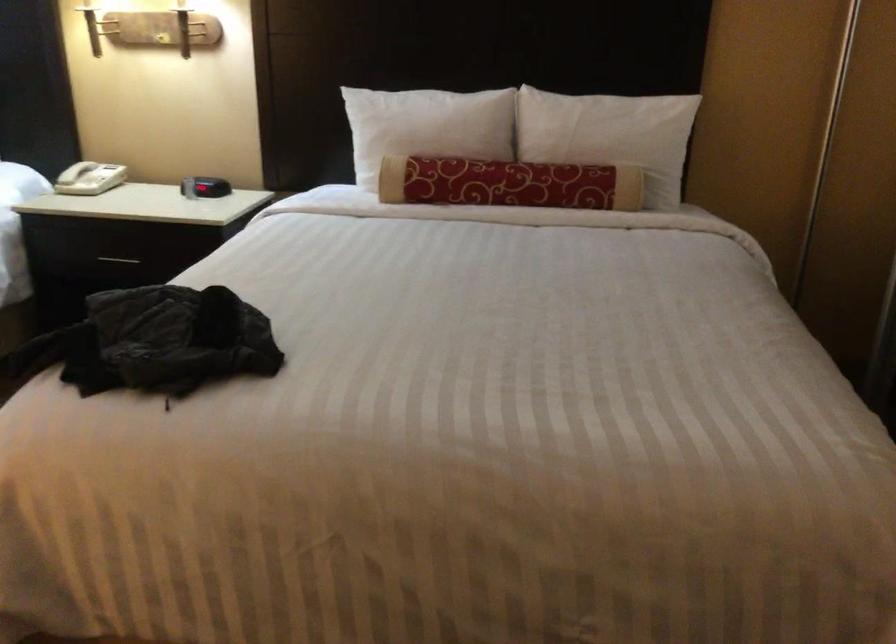
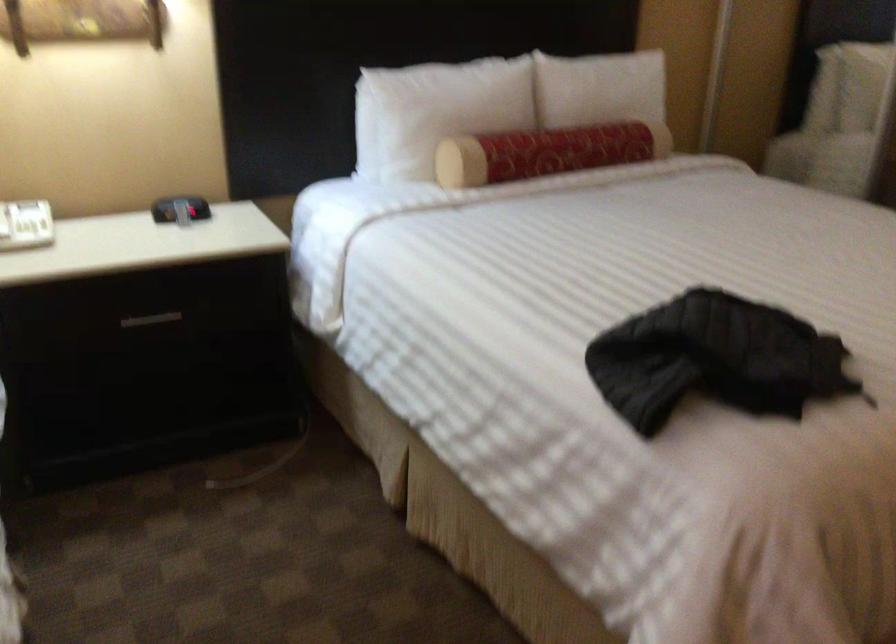
Find the pixel in the second image that matches point 470,182 in the first image.

(546, 152)